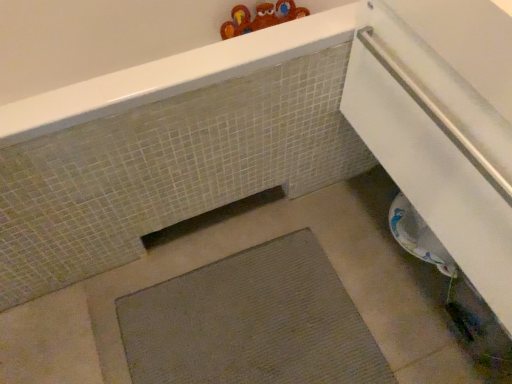
Measure the distance between point (228, 158) and camera.

3.50 feet.

This screenshot has height=384, width=512. Describe the element at coordinates (169, 148) in the screenshot. I see `matte gray mat at lower center` at that location.

The height and width of the screenshot is (384, 512). What do you see at coordinates (252, 323) in the screenshot? I see `gray textured bath mat at center` at bounding box center [252, 323].

Where is `matte gray mat at lower center`? matte gray mat at lower center is located at coordinates (169, 148).

Which is more distant, (351, 59) or (30, 181)?

Positioned behind is point (351, 59).

Considering the sizes of objects white glossy towel at lower right and matte gray mat at lower center in the image provided, who is bigger, white glossy towel at lower right or matte gray mat at lower center?

matte gray mat at lower center is bigger.

Considering the sizes of white glossy towel at lower right and matte gray mat at lower center in the image, is white glossy towel at lower right wider or thinner than matte gray mat at lower center?

In the image, white glossy towel at lower right appears to be more narrow than matte gray mat at lower center.

Looking at the image, does gray textured bath mat at center seem bigger or smaller compared to matte gray mat at lower center?

Clearly, gray textured bath mat at center is smaller in size than matte gray mat at lower center.

I want to click on bath mat below the matte gray mat at lower center (from the image's perspective), so click(252, 323).

Which object is closer to the camera taking this photo, gray textured bath mat at center or matte gray mat at lower center?

matte gray mat at lower center is closer to the camera.

Looking at this image, from the image's perspective, between gray textured bath mat at center and matte gray mat at lower center, who is located below?

gray textured bath mat at center, from the image's perspective.

Is matte gray mat at lower center looking in the opposite direction of gray textured bath mat at center?

No, gray textured bath mat at center is not at the back of matte gray mat at lower center.

Who is smaller, matte gray mat at lower center or gray textured bath mat at center?

gray textured bath mat at center.

Is the surface of matte gray mat at lower center in direct contact with gray textured bath mat at center?

No, matte gray mat at lower center is not with gray textured bath mat at center.

From a real-world perspective, between white glossy towel at lower right and gray textured bath mat at center, who is vertically lower?

In real-world perspective, gray textured bath mat at center is lower.

Is white glossy towel at lower right oriented towards gray textured bath mat at center?

No, white glossy towel at lower right is not facing towards gray textured bath mat at center.

Locate an element on the screen. bath mat that appears on the left of white glossy towel at lower right is located at coordinates (252, 323).

Is white glossy towel at lower right not close to gray textured bath mat at center?

No.

Is matte gray mat at lower center directly adjacent to white glossy towel at lower right?

They are not placed beside each other.

From a real-world perspective, relative to white glossy towel at lower right, is matte gray mat at lower center vertically above or below?

Clearly, from a real-world perspective, matte gray mat at lower center is below white glossy towel at lower right.

Is point (217, 91) farther from camera compared to point (437, 183)?

Yes, it is.

Is matte gray mat at lower center facing away from white glossy towel at lower right?

No.

Is gray textured bath mat at center not inside white glossy towel at lower right?

Yes.

Is gray textured bath mat at center facing away from white glossy towel at lower right?

gray textured bath mat at center is not turned away from white glossy towel at lower right.

Which of these two, gray textured bath mat at center or white glossy towel at lower right, stands taller?

white glossy towel at lower right.

Which of these two, gray textured bath mat at center or white glossy towel at lower right, is thinner?

white glossy towel at lower right is thinner.

What are the coordinates of `bath above the white glossy towel at lower right (from the image's perspective)` in the screenshot? It's located at (169, 148).

Locate an element on the screen. bath in front of the gray textured bath mat at center is located at coordinates (169, 148).

From the image, which object appears to be nearer to gray textured bath mat at center, white glossy towel at lower right or matte gray mat at lower center?

matte gray mat at lower center.

Looking at the image, which one is located further to white glossy towel at lower right, matte gray mat at lower center or gray textured bath mat at center?

The object further to white glossy towel at lower right is gray textured bath mat at center.

Looking at the image, which one is located closer to matte gray mat at lower center, gray textured bath mat at center or white glossy towel at lower right?

gray textured bath mat at center.

Estimate the real-world distances between objects in this image. Which object is closer to gray textured bath mat at center, matte gray mat at lower center or white glossy towel at lower right?

Among the two, matte gray mat at lower center is located nearer to gray textured bath mat at center.

Estimate the real-world distances between objects in this image. Which object is closer to white glossy towel at lower right, gray textured bath mat at center or matte gray mat at lower center?

Among the two, matte gray mat at lower center is located nearer to white glossy towel at lower right.

Estimate the real-world distances between objects in this image. Which object is further from matte gray mat at lower center, white glossy towel at lower right or gray textured bath mat at center?

white glossy towel at lower right.

Locate an element on the screen. The height and width of the screenshot is (384, 512). screen door between matte gray mat at lower center and gray textured bath mat at center in the vertical direction is located at coordinates (436, 146).